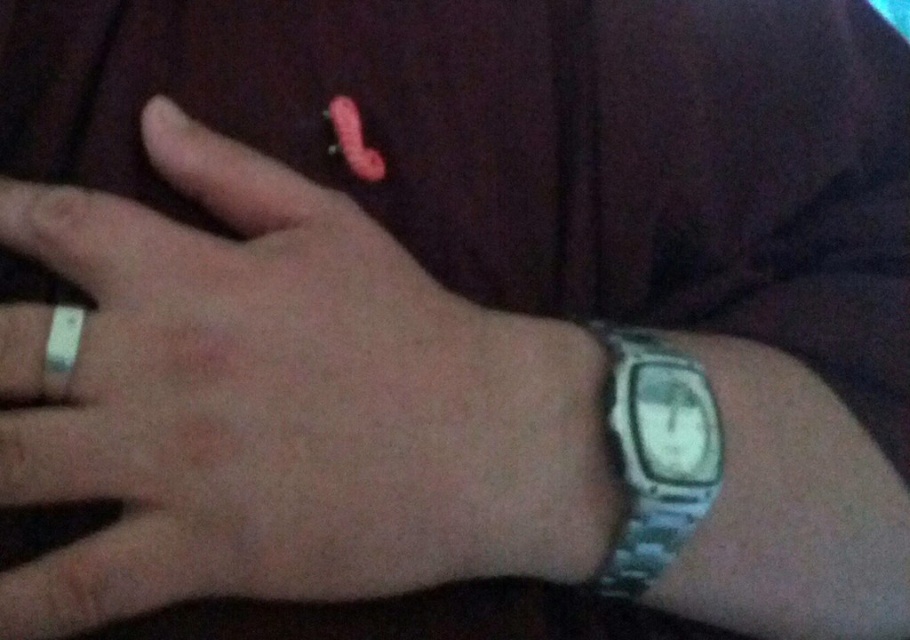
Question: Can you confirm if metallic watch at right is positioned below silver metallic ring at left?

Choices:
 (A) yes
 (B) no

Answer: (A)

Question: Which of the following is the closest to the observer?

Choices:
 (A) (72, 344)
 (B) (680, 492)

Answer: (A)

Question: Can you confirm if metallic silver watch at right is bigger than silver metallic ring at left?

Choices:
 (A) no
 (B) yes

Answer: (B)

Question: Does metallic watch at right come in front of metallic silver watch at right?

Choices:
 (A) yes
 (B) no

Answer: (A)

Question: Which point is closer to the camera taking this photo?

Choices:
 (A) [52, 328]
 (B) [182, 476]

Answer: (B)

Question: Among these objects, which one is farthest from the camera?

Choices:
 (A) metallic watch at right
 (B) silver metallic ring at left

Answer: (B)